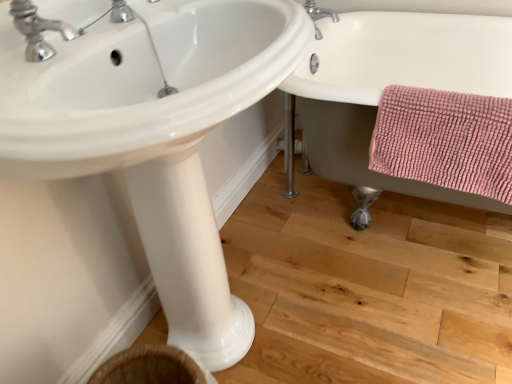
The image size is (512, 384). Identify the location of blank space above pink chenille bath towel at lower right (from a real-world perspective). (449, 97).